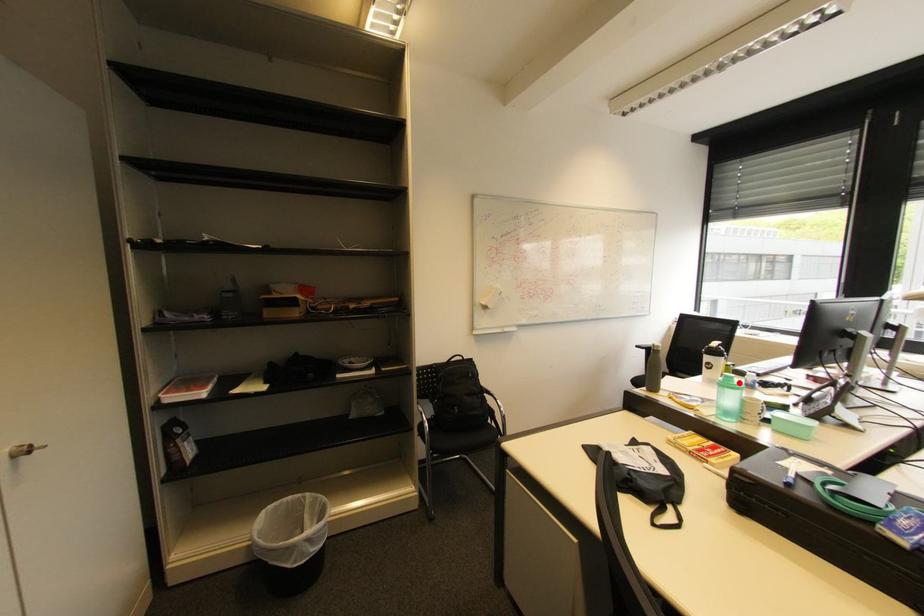
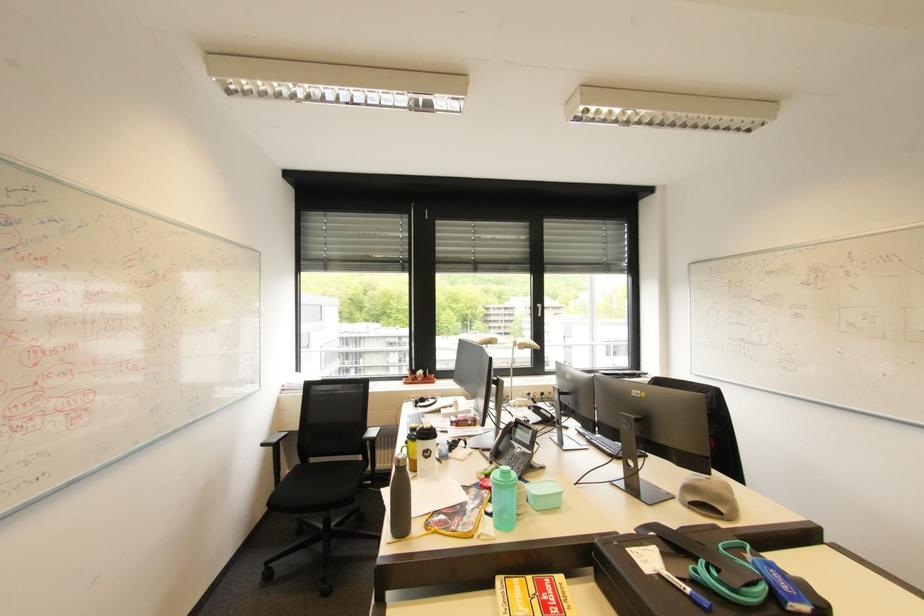
The point at the highlighted location is marked in the first image. Where is the corresponding point in the second image?

(517, 477)